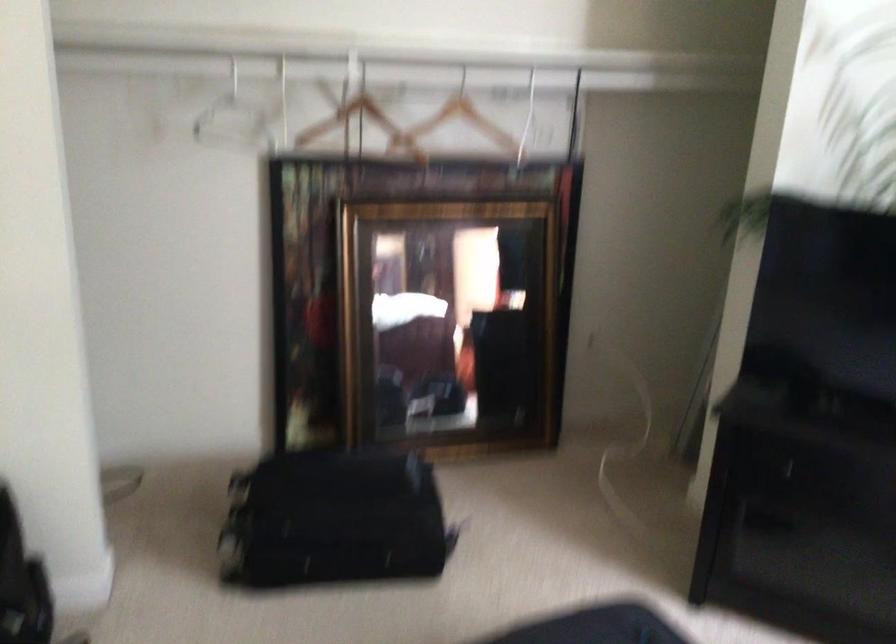
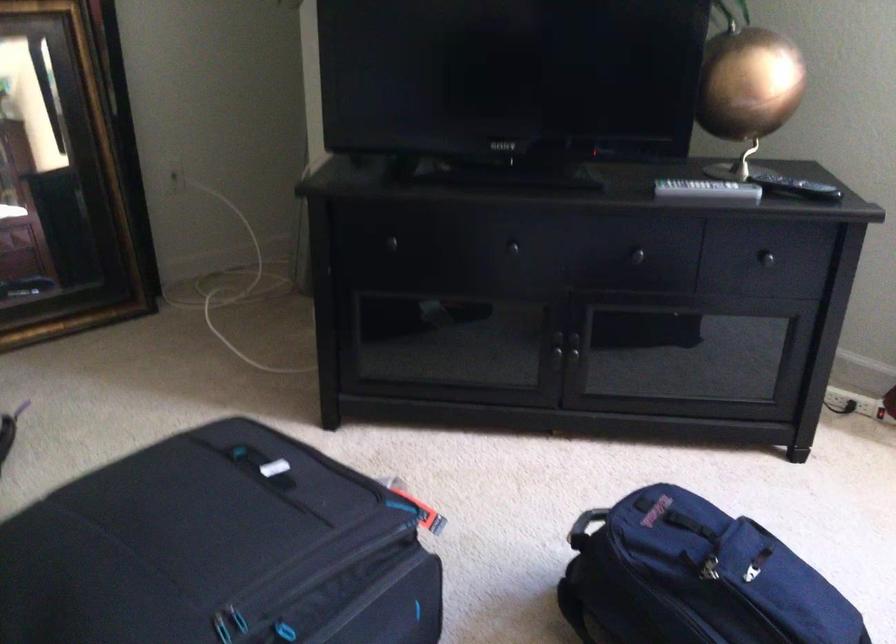
Question: The first image is from the beginning of the video and the second image is from the end. How did the camera likely rotate when shooting the video?

Choices:
 (A) Left
 (B) Right
 (C) Up
 (D) Down

Answer: (B)